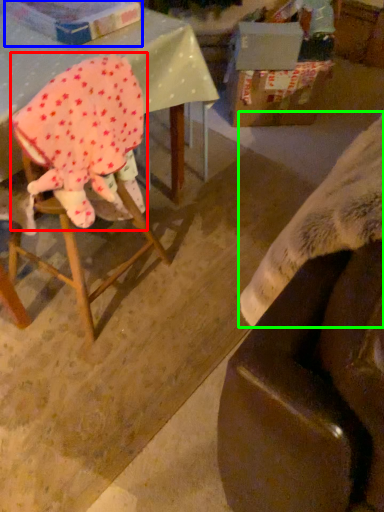
Question: Which object is positioned closest to woman (highlighted by a red box)? Select from cardboard box (highlighted by a blue box) and blanket (highlighted by a green box).

Choices:
 (A) cardboard box
 (B) blanket

Answer: (A)